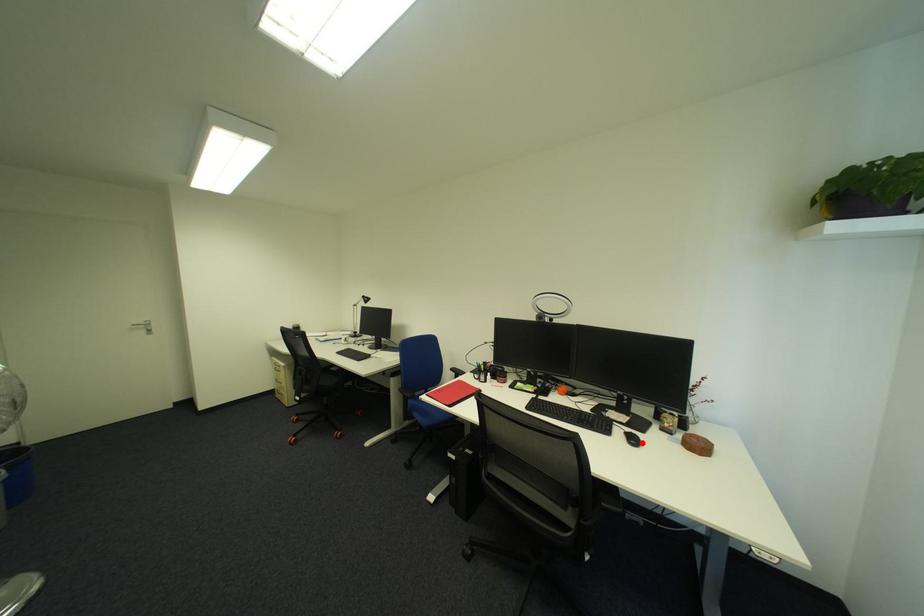
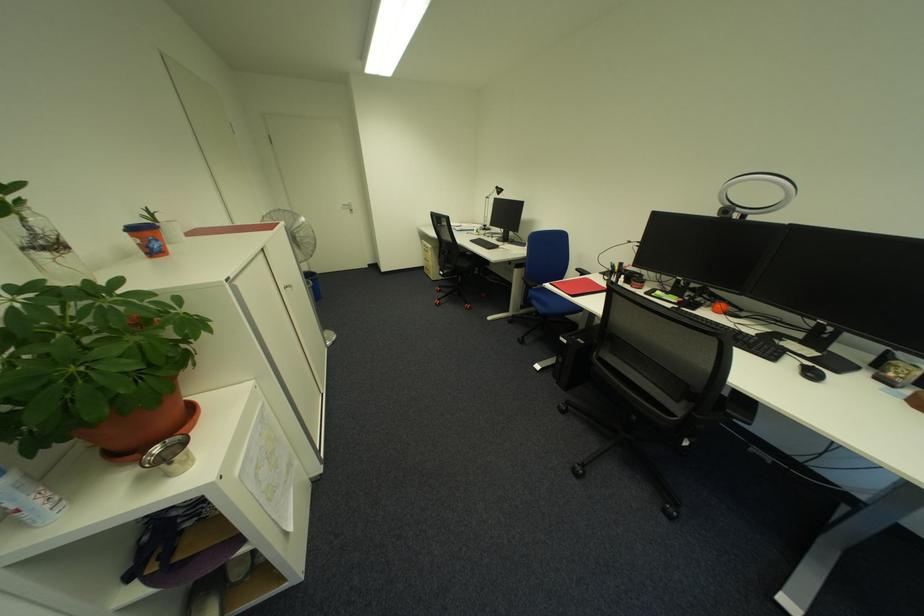
Locate, in the second image, the point that corresponds to the highlighted location in the first image.

(820, 376)